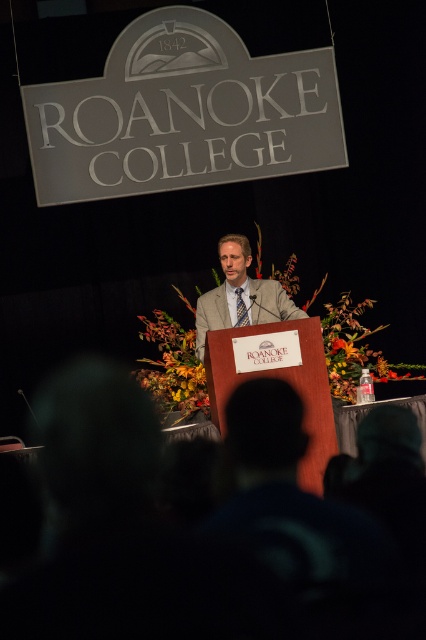
Question: Which point appears farthest from the camera in this image?

Choices:
 (A) (244, 317)
 (B) (222, 268)

Answer: (B)

Question: Does light brown suit at center come behind blue checkered tie at center?

Choices:
 (A) yes
 (B) no

Answer: (B)

Question: Which point is closer to the camera?

Choices:
 (A) blue checkered tie at center
 (B) light brown suit at center

Answer: (B)

Question: Which point is farther to the camera?

Choices:
 (A) (233, 285)
 (B) (244, 310)

Answer: (A)

Question: Can you confirm if light brown suit at center is positioned above blue checkered tie at center?

Choices:
 (A) no
 (B) yes

Answer: (B)

Question: Considering the relative positions of light brown suit at center and blue checkered tie at center in the image provided, where is light brown suit at center located with respect to blue checkered tie at center?

Choices:
 (A) left
 (B) right

Answer: (B)